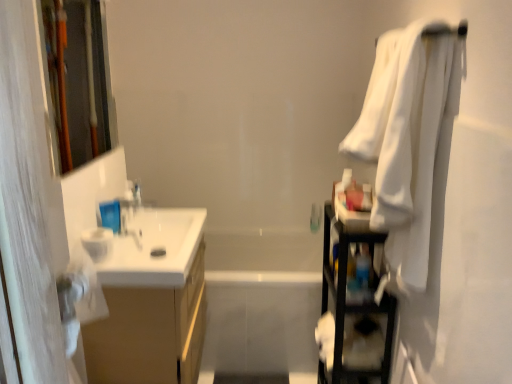
Question: Considering the positions of white soft towel at right and white glossy sink at left in the image, is white soft towel at right taller or shorter than white glossy sink at left?

Choices:
 (A) tall
 (B) short

Answer: (A)

Question: In the image, is white soft towel at right on the left side or the right side of white glossy sink at left?

Choices:
 (A) left
 (B) right

Answer: (B)

Question: Which object is positioned farthest from the white glossy sink at left?

Choices:
 (A) satin silver faucet at upper left
 (B) black plastic shelf at right
 (C) white glossy bathtub at center
 (D) clear plastic bottle at upper left
 (E) white soft towel at right

Answer: (E)

Question: Which object is the closest to the wooden frame at left?

Choices:
 (A) matte wood cabinet at left
 (B) satin silver faucet at upper left
 (C) black plastic shelf at right
 (D) white glossy bathtub at center
 (E) clear plastic bottle at upper left

Answer: (B)